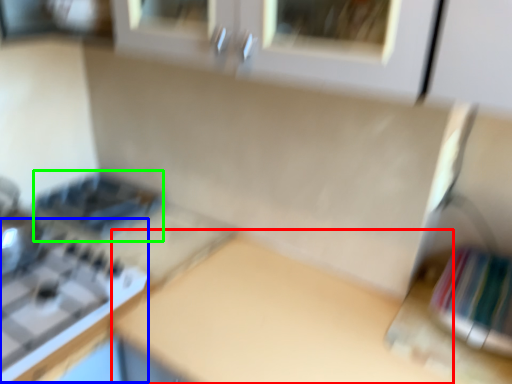
Question: Which is nearer to the counter top (highlighted by a red box)? gas stove (highlighted by a blue box) or appliance (highlighted by a green box).

Choices:
 (A) gas stove
 (B) appliance

Answer: (A)